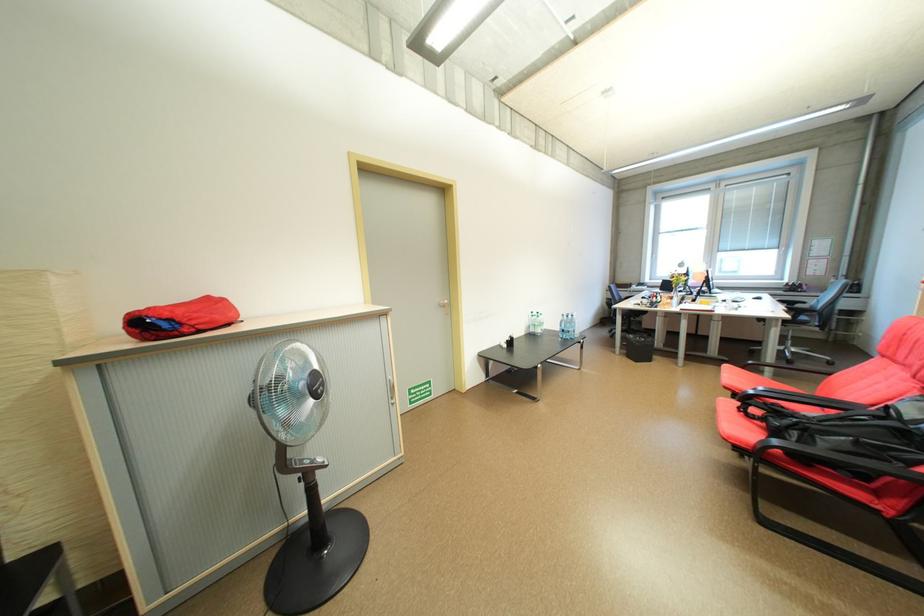
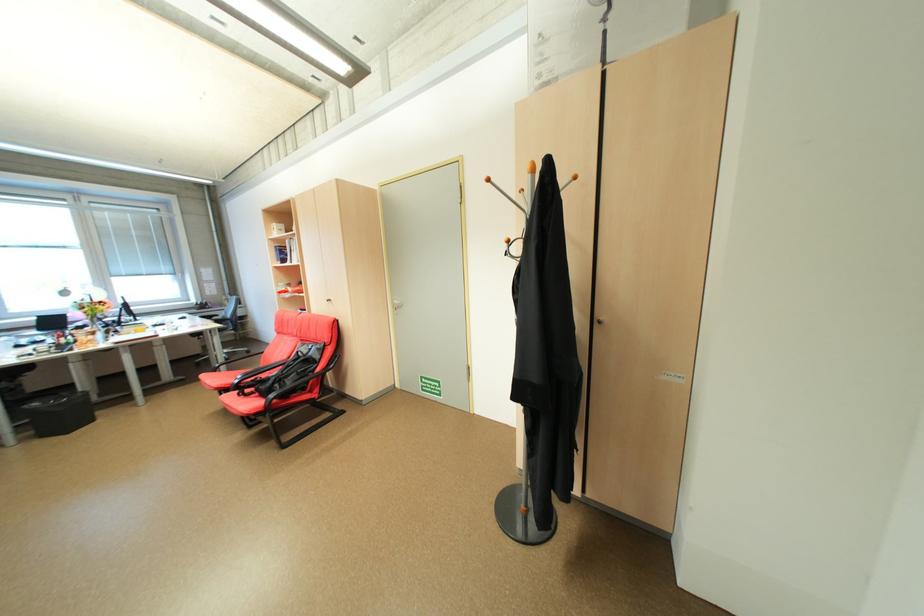
Locate, in the second image, the point that corresponds to [805,434] in the first image.

(286, 386)